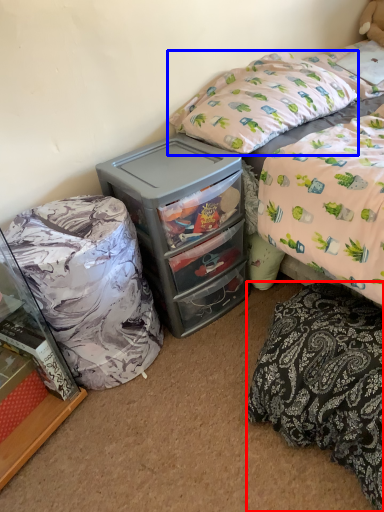
Question: Which object is closer to the camera taking this photo, mattress (highlighted by a red box) or pillow (highlighted by a blue box)?

Choices:
 (A) mattress
 (B) pillow

Answer: (A)